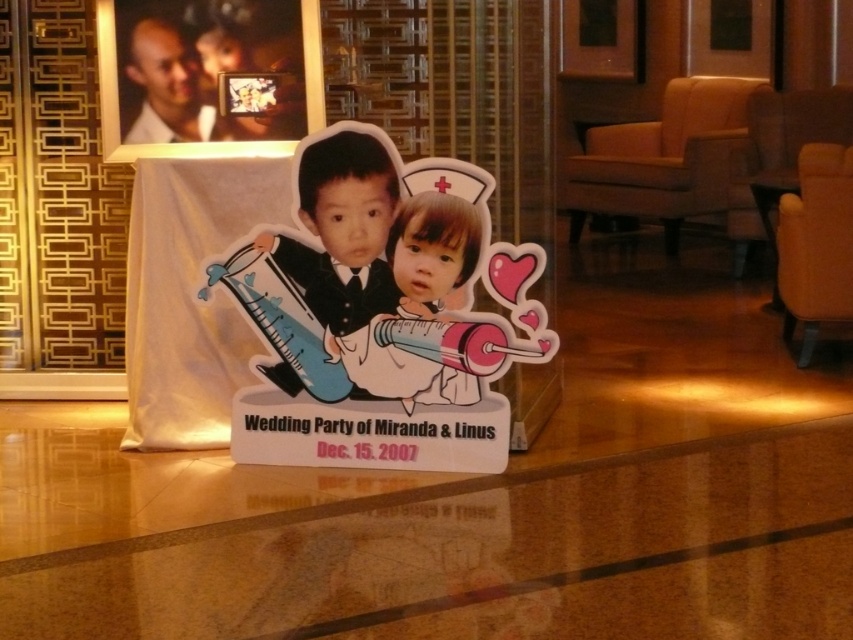
You are a photographer setting up for a photo shoot at Miranda and Linus wedding party. You need to ensure that the matte black suit at center and the matte white child at center are positioned exactly 10 inches apart. Based on the scene description, is the current arrangement correct?

The matte black suit at center and the matte white child at center are 10.06 inches apart from each other, so the current arrangement is correct as it meets the required distance of 10 inches.

You are a photographer setting up for the wedding party photo. You notice the matte black suit at center and the matte white child at center. Which object should you adjust to ensure both are fully visible in the frame?

The matte black suit at center is much taller than the matte white child at center, so you should lower the camera angle slightly to include the entire matte black suit at center while keeping the matte white child at center in view.